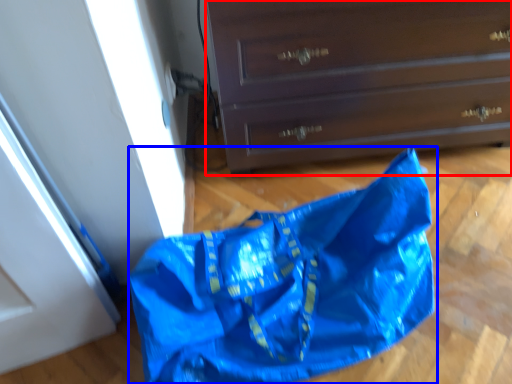
Question: Which object appears closest to the camera in this image, chest of drawers (highlighted by a red box) or grocery bag (highlighted by a blue box)?

Choices:
 (A) chest of drawers
 (B) grocery bag

Answer: (B)